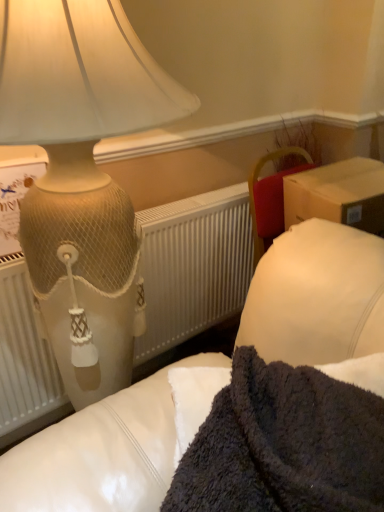
I want to click on matte cream lamp at upper left, so click(x=82, y=175).

Measure the distance between point (37, 333) and camera.

1.33 meters.

In order to click on matte cream lamp at upper left in this screenshot , I will do `click(82, 175)`.

Considering the positions of objects matte cream lamp at upper left and white textured radiator at left in the image provided, who is more to the right, matte cream lamp at upper left or white textured radiator at left?

From the viewer's perspective, white textured radiator at left appears more on the right side.

Consider the image. Considering the sizes of objects matte cream lamp at upper left and white textured radiator at left in the image provided, who is shorter, matte cream lamp at upper left or white textured radiator at left?

white textured radiator at left.

Is matte cream lamp at upper left completely or partially outside of white textured radiator at left?

Absolutely, matte cream lamp at upper left is external to white textured radiator at left.

From the picture: Would you say matte cream lamp at upper left is a long distance from white textured radiator at left?

matte cream lamp at upper left is near white textured radiator at left, not far away.

Is matte cream lamp at upper left further to the viewer compared to dark fuzzy blanket at lower right?

Yes, the depth of matte cream lamp at upper left is greater than that of dark fuzzy blanket at lower right.

Between point (48, 275) and point (214, 476), which one is positioned behind?

Positioned behind is point (48, 275).

From a real-world perspective, is matte cream lamp at upper left positioned above or below dark fuzzy blanket at lower right?

In terms of real-world spatial position, matte cream lamp at upper left is above dark fuzzy blanket at lower right.

In terms of height, does white textured radiator at left look taller or shorter compared to dark fuzzy blanket at lower right?

In the image, white textured radiator at left appears to be taller than dark fuzzy blanket at lower right.

This screenshot has width=384, height=512. What are the coordinates of `radiator behind the dark fuzzy blanket at lower right` in the screenshot? It's located at (193, 267).

Which object is further away from the camera, white textured radiator at left or dark fuzzy blanket at lower right?

white textured radiator at left is more distant.

Are dark fuzzy blanket at lower right and white textured radiator at left located far from each other?

No.

Is point (343, 395) closer or farther from the camera than point (200, 216)?

Point (343, 395) is closer to the camera than point (200, 216).

Is dark fuzzy blanket at lower right positioned with its back to white textured radiator at left?

Absolutely, dark fuzzy blanket at lower right is directed away from white textured radiator at left.

Can you confirm if dark fuzzy blanket at lower right is taller than white textured radiator at left?

No, dark fuzzy blanket at lower right is not taller than white textured radiator at left.

Which of these two, white textured radiator at left or matte cream lamp at upper left, is smaller?

With smaller size is white textured radiator at left.

Does white textured radiator at left touch matte cream lamp at upper left?

white textured radiator at left is not next to matte cream lamp at upper left, and they're not touching.

From their relative heights in the image, would you say white textured radiator at left is taller or shorter than matte cream lamp at upper left?

In the image, white textured radiator at left appears to be shorter than matte cream lamp at upper left.

Is matte cream lamp at upper left a part of dark fuzzy blanket at lower right?

That's incorrect, matte cream lamp at upper left is not inside dark fuzzy blanket at lower right.

Is point (340, 398) closer or farther from the camera than point (132, 315)?

Point (340, 398).

From a real-world perspective, which is physically below, dark fuzzy blanket at lower right or matte cream lamp at upper left?

In real-world perspective, dark fuzzy blanket at lower right is lower.

Considering the relative sizes of dark fuzzy blanket at lower right and matte cream lamp at upper left in the image provided, is dark fuzzy blanket at lower right thinner than matte cream lamp at upper left?

Indeed, dark fuzzy blanket at lower right has a lesser width compared to matte cream lamp at upper left.

Find the location of `lamp located in front of the white textured radiator at left`. lamp located in front of the white textured radiator at left is located at coordinates (82, 175).

Find the location of a particular element. Image resolution: width=384 pixels, height=512 pixels. lamp positioned vertically above the dark fuzzy blanket at lower right (from a real-world perspective) is located at coordinates (82, 175).

Which object lies further to the anchor point white textured radiator at left, dark fuzzy blanket at lower right or matte cream lamp at upper left?

Based on the image, dark fuzzy blanket at lower right appears to be further to white textured radiator at left.

Considering their positions, is matte cream lamp at upper left positioned further to white textured radiator at left than dark fuzzy blanket at lower right?

Based on the image, dark fuzzy blanket at lower right appears to be further to white textured radiator at left.

Considering their positions, is dark fuzzy blanket at lower right positioned further to matte cream lamp at upper left than white textured radiator at left?

dark fuzzy blanket at lower right.

Looking at the image, which one is located closer to dark fuzzy blanket at lower right, white textured radiator at left or matte cream lamp at upper left?

Among the two, matte cream lamp at upper left is located nearer to dark fuzzy blanket at lower right.

Which object lies nearer to the anchor point dark fuzzy blanket at lower right, matte cream lamp at upper left or white textured radiator at left?

matte cream lamp at upper left is positioned closer to the anchor dark fuzzy blanket at lower right.

From the picture: Based on their spatial positions, is white textured radiator at left or dark fuzzy blanket at lower right closer to matte cream lamp at upper left?

Based on the image, white textured radiator at left appears to be nearer to matte cream lamp at upper left.

The height and width of the screenshot is (512, 384). Identify the location of lamp between dark fuzzy blanket at lower right and white textured radiator at left in the front-back direction. (82, 175).